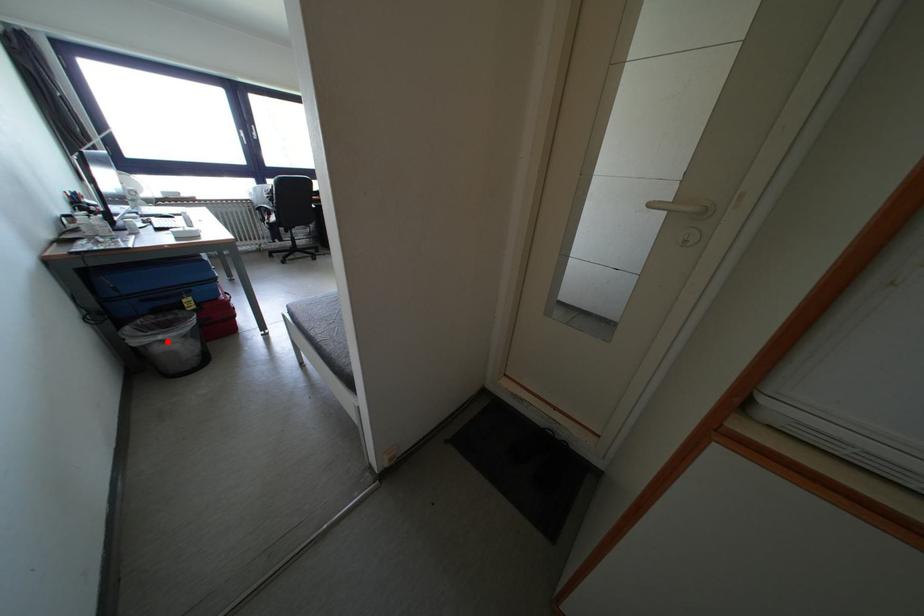
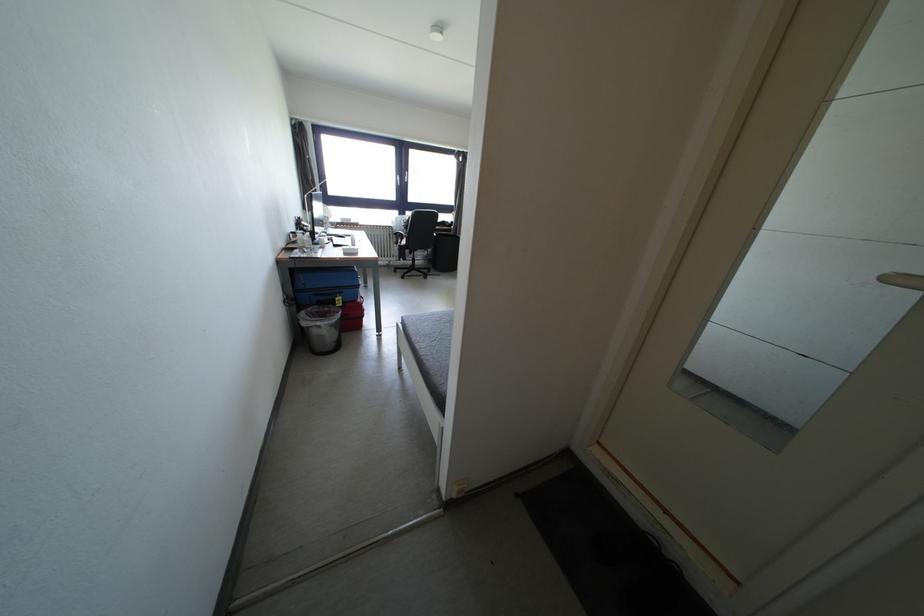
Question: I am providing you with two images of the same scene from different viewpoints. A red point is shown in image1. For the corresponding object point in image2, is it positioned nearer or farther from the camera?

Choices:
 (A) Nearer
 (B) Farther

Answer: (A)